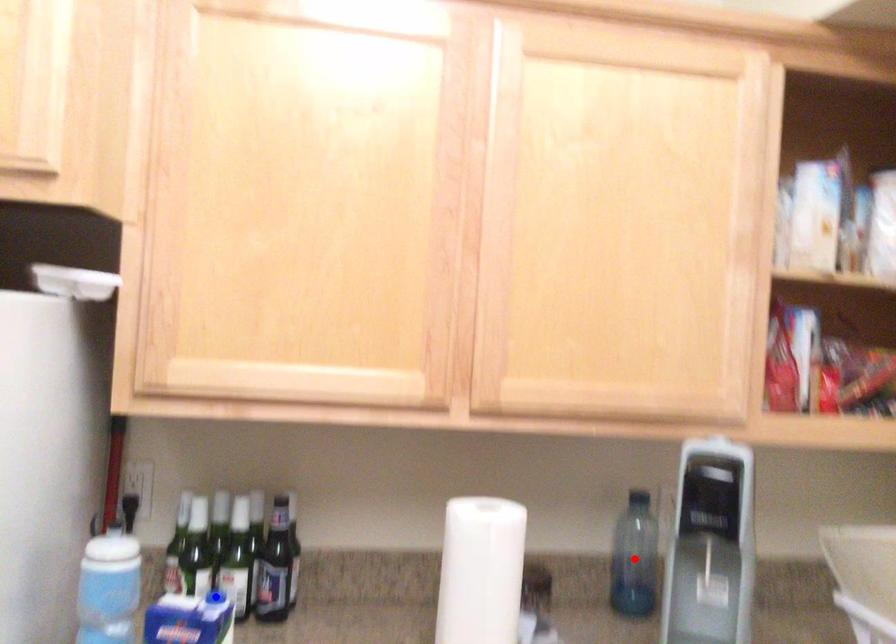
Question: In the image, two points are highlighted. Which point is nearer to the camera? Reply with the corresponding letter.

Choices:
 (A) blue point
 (B) red point

Answer: (A)